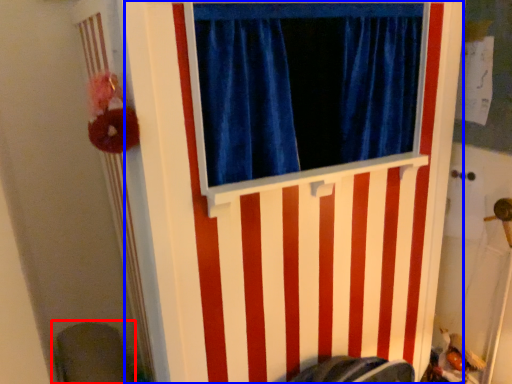
Question: Which of the following is the closest to the observer, swivel chair (highlighted by a red box) or barn door (highlighted by a blue box)?

Choices:
 (A) swivel chair
 (B) barn door

Answer: (B)